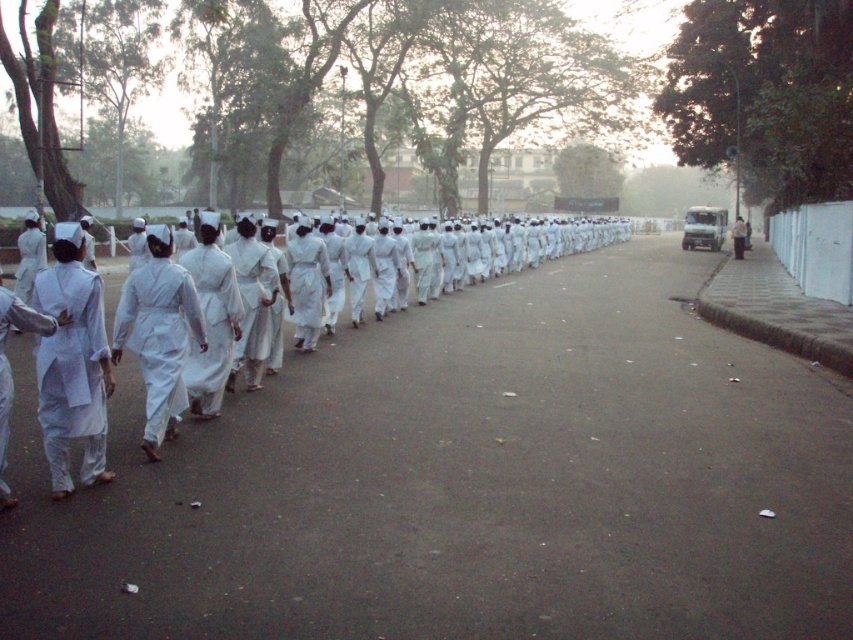
You are a photographer positioned at the center of the road, aiming to capture the marching group. You notice two points marked in the scene. Which of the two points, point (138, 324) or point (743, 240), is closer to your camera position?

Point (138, 324) is closer to the camera than point (743, 240).

You are a photographer trying to capture the group of marchers in the scene. You notice the white matte uniform at left and the white cloth dress at center. Which of these two items would appear smaller in your photo?

The white matte uniform at left appears smaller in the photo because it has a smaller size compared to the white cloth dress at center.